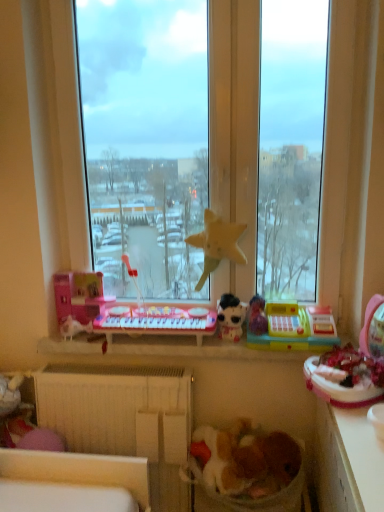
Question: Is fluffy fabric laundry basket at lower center placed right next to pink plastic toy at left, the fourth toy when ordered from right to left?

Choices:
 (A) no
 (B) yes

Answer: (A)

Question: Does fluffy fabric laundry basket at lower center lie behind pink plastic toy at left, which is the 1th toy from left to right?

Choices:
 (A) yes
 (B) no

Answer: (B)

Question: From a real-world perspective, is fluffy fabric laundry basket at lower center on pink plastic toy at left, which is the 1th toy from left to right?

Choices:
 (A) yes
 (B) no

Answer: (B)

Question: Does fluffy fabric laundry basket at lower center have a lesser width compared to pink plastic toy at left, the fourth toy when ordered from right to left?

Choices:
 (A) no
 (B) yes

Answer: (A)

Question: Does fluffy fabric laundry basket at lower center have a lesser height compared to pink plastic toy at left, the fourth toy when ordered from right to left?

Choices:
 (A) no
 (B) yes

Answer: (A)

Question: Would you consider fluffy fabric laundry basket at lower center to be distant from pink plastic toy at left, which is the 1th toy from left to right?

Choices:
 (A) no
 (B) yes

Answer: (A)

Question: Does white plastic toys at center appear on the right side of white glossy counter top at lower right?

Choices:
 (A) yes
 (B) no

Answer: (B)

Question: Considering the relative sizes of white plastic toys at center and white glossy counter top at lower right in the image provided, is white plastic toys at center smaller than white glossy counter top at lower right?

Choices:
 (A) yes
 (B) no

Answer: (A)

Question: Would you consider white plastic toys at center to be distant from white glossy counter top at lower right?

Choices:
 (A) yes
 (B) no

Answer: (B)

Question: From a real-world perspective, is white plastic toys at center positioned under white glossy counter top at lower right based on gravity?

Choices:
 (A) no
 (B) yes

Answer: (A)

Question: Does white plastic toys at center have a greater width compared to white glossy counter top at lower right?

Choices:
 (A) no
 (B) yes

Answer: (A)

Question: Could white glossy counter top at lower right be considered to be inside white plastic toys at center?

Choices:
 (A) yes
 (B) no

Answer: (B)

Question: Considering the relative sizes of fluffy fabric laundry basket at lower center and white glossy counter top at lower right in the image provided, is fluffy fabric laundry basket at lower center thinner than white glossy counter top at lower right?

Choices:
 (A) no
 (B) yes

Answer: (B)